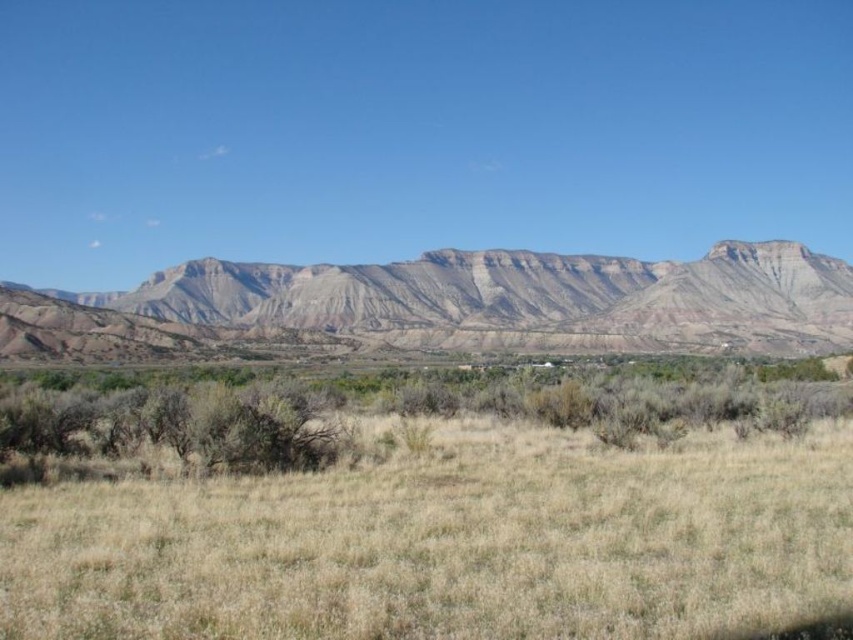
Question: Among these points, which one is farthest from the camera?

Choices:
 (A) (28, 540)
 (B) (531, 346)

Answer: (B)

Question: Where is dry grassland at center located in relation to rustic rock mountain range at center in the image?

Choices:
 (A) below
 (B) above

Answer: (A)

Question: Which point appears farthest from the camera in this image?

Choices:
 (A) [x=227, y=561]
 (B) [x=403, y=268]

Answer: (B)

Question: Which of the following is the closest to the observer?

Choices:
 (A) (602, 502)
 (B) (370, 292)

Answer: (A)

Question: Can you confirm if dry grassland at center is positioned below rustic rock mountain range at center?

Choices:
 (A) no
 (B) yes

Answer: (B)

Question: Is dry grassland at center smaller than rustic rock mountain range at center?

Choices:
 (A) no
 (B) yes

Answer: (B)